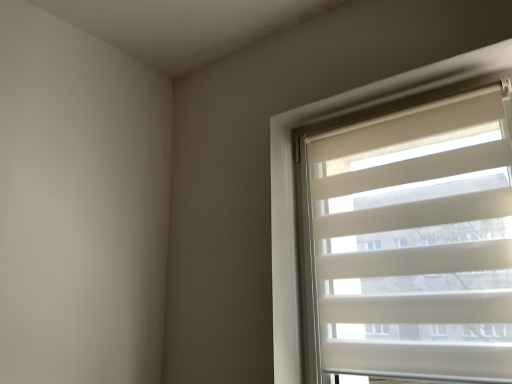
What do you see at coordinates (409, 243) in the screenshot? I see `white fabric blinds at upper right` at bounding box center [409, 243].

At what (x,y) coordinates should I click in order to perform the action: click on white fabric blinds at upper right. Please return your answer as a coordinate pair (x, y). The height and width of the screenshot is (384, 512). Looking at the image, I should click on (409, 243).

The width and height of the screenshot is (512, 384). I want to click on white fabric blinds at upper right, so click(409, 243).